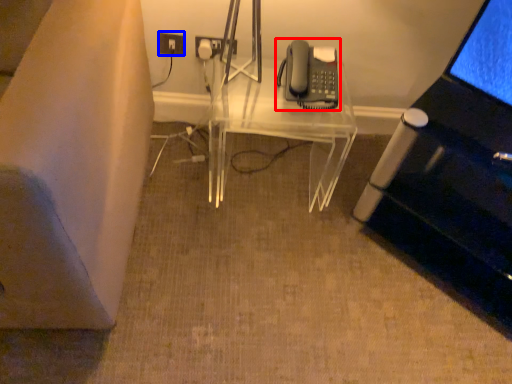
Question: Among these objects, which one is nearest to the camera, corded phone (highlighted by a red box) or electric outlet (highlighted by a blue box)?

Choices:
 (A) corded phone
 (B) electric outlet

Answer: (A)